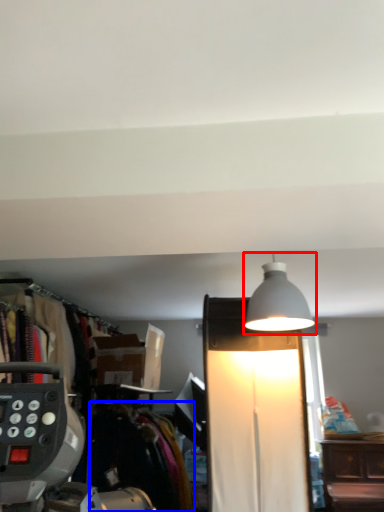
Question: Which object is closer to the camera taking this photo, lamp (highlighted by a red box) or clothing (highlighted by a blue box)?

Choices:
 (A) lamp
 (B) clothing

Answer: (A)